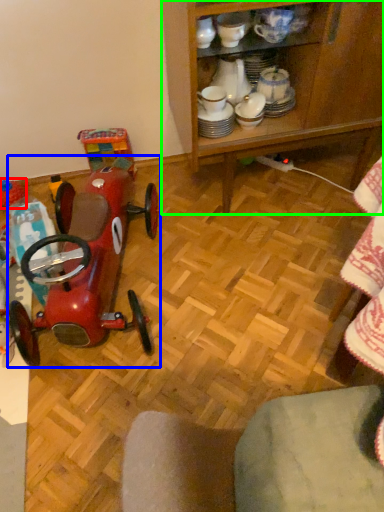
Question: Which is farther away from toy (highlighted by a red box)? toy (highlighted by a blue box) or cabinetry (highlighted by a green box)?

Choices:
 (A) toy
 (B) cabinetry

Answer: (B)